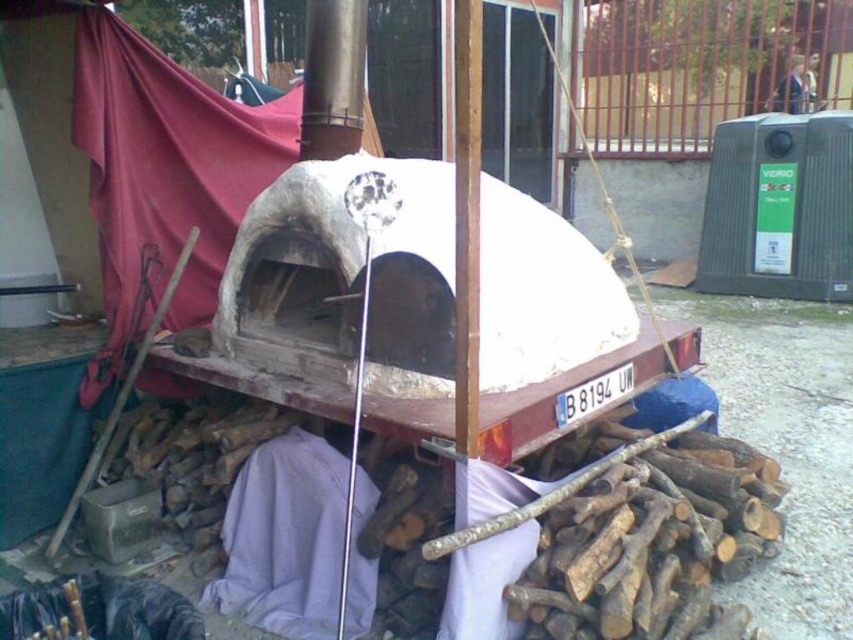
From the picture: You are standing at the edge of the gravel surface near the red trailer. You want to place a new decorative flag exactly where the purple fabric at center is currently located. What are the coordinates where you should place the flag?

The coordinates for the purple fabric at center are at point (285, 538), so you should place the flag there.